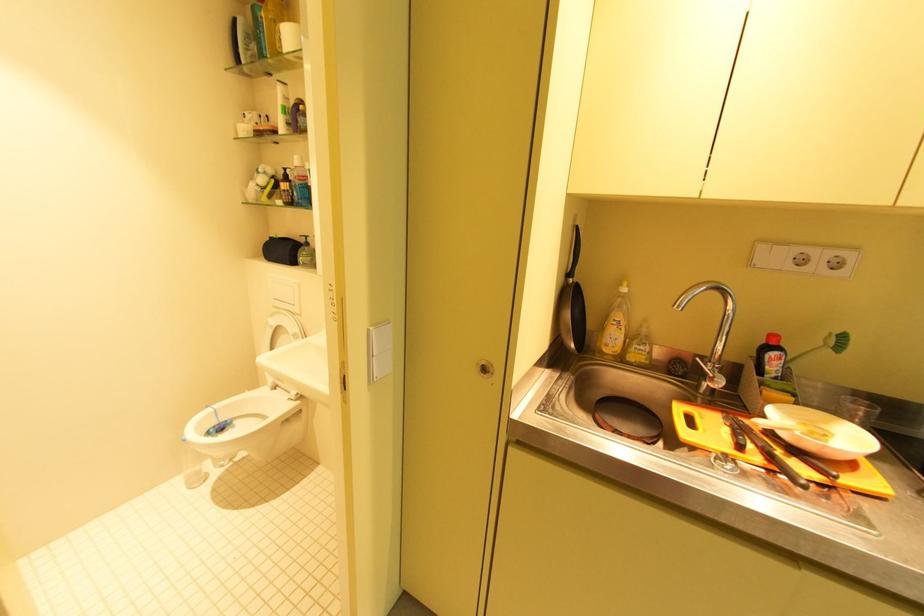
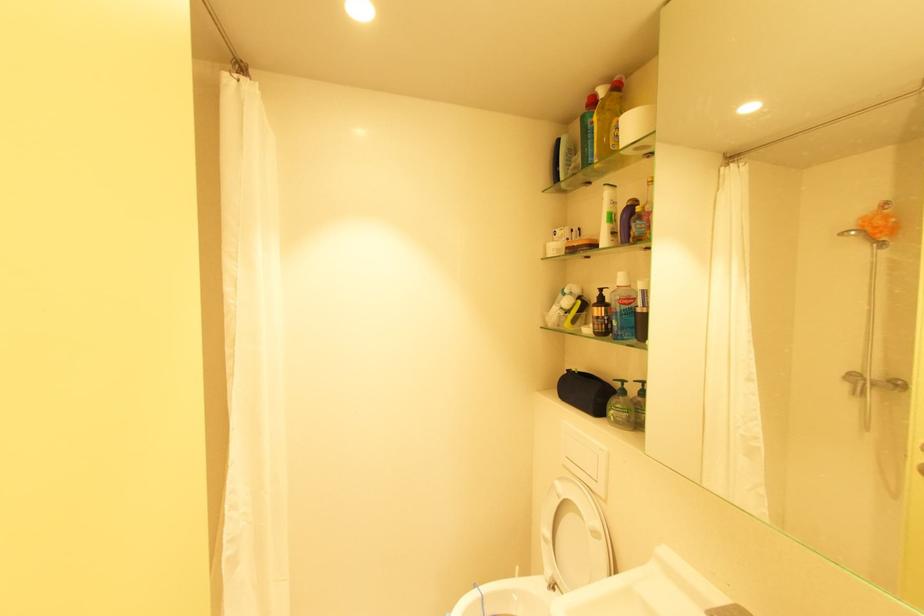
In the second image, find the point that corresponds to point 304,199 in the first image.

(623, 330)